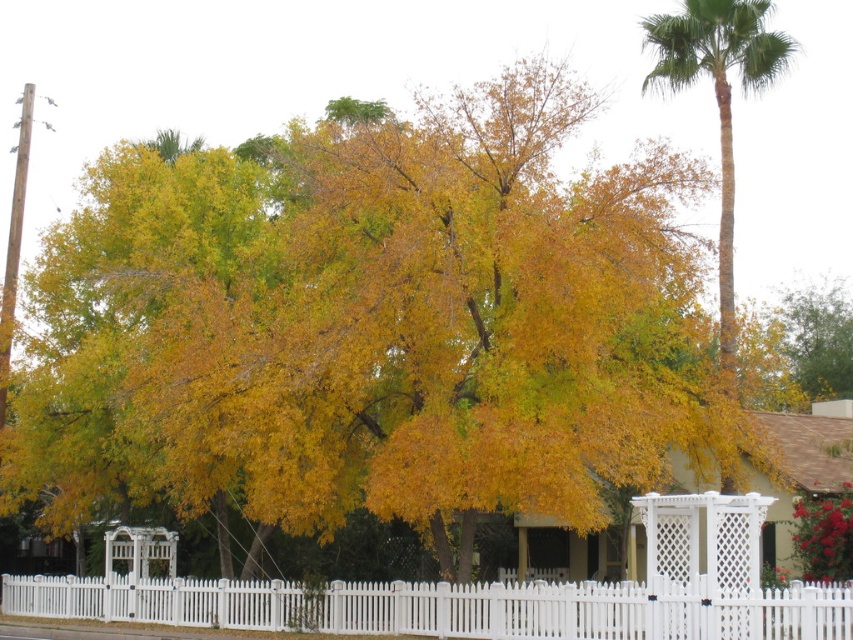
Question: Is white picket fence at center above green leafy palm at upper right?

Choices:
 (A) no
 (B) yes

Answer: (A)

Question: Can you confirm if white picket fence at center is positioned above green leafy palm at upper right?

Choices:
 (A) no
 (B) yes

Answer: (A)

Question: Does white picket fence at center appear under green leafy palm at upper right?

Choices:
 (A) no
 (B) yes

Answer: (B)

Question: Among these points, which one is nearest to the camera?

Choices:
 (A) (149, 580)
 (B) (718, 228)

Answer: (A)